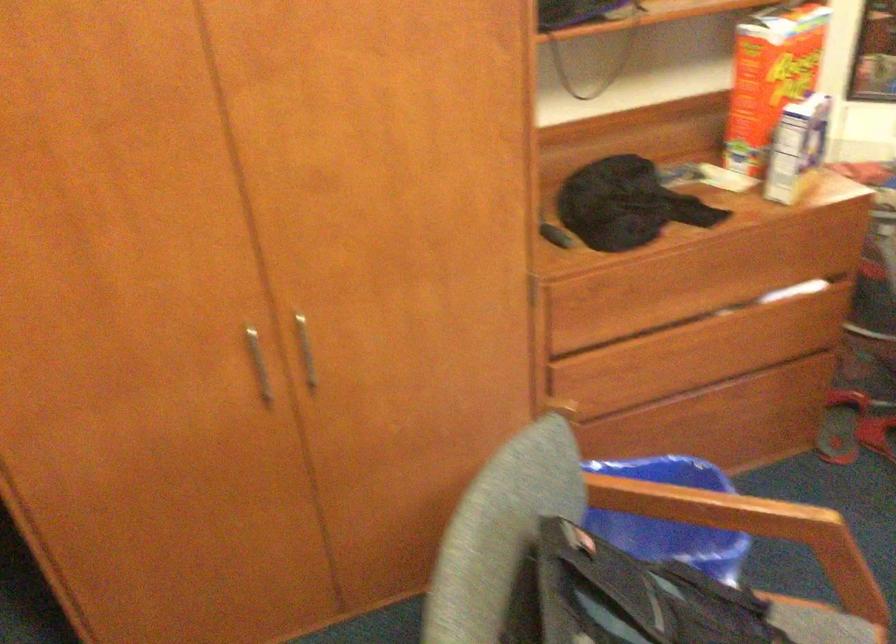
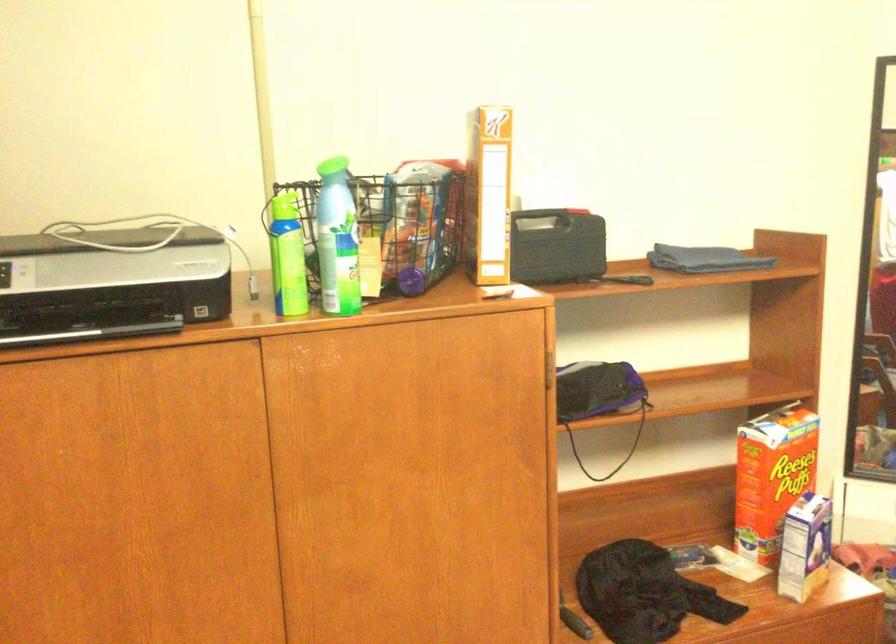
In the second image, find the point that corresponds to point 626,205 in the first image.

(643, 592)